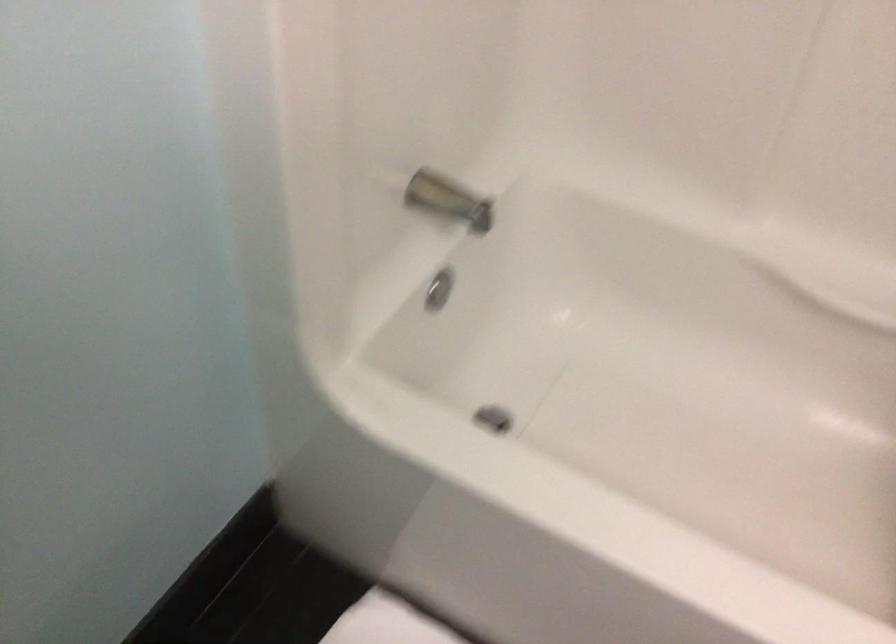
Question: Based on the continuous images, in which direction is the camera rotating? Reply with the corresponding letter.

Choices:
 (A) Left
 (B) Right
 (C) Up
 (D) Down

Answer: (D)